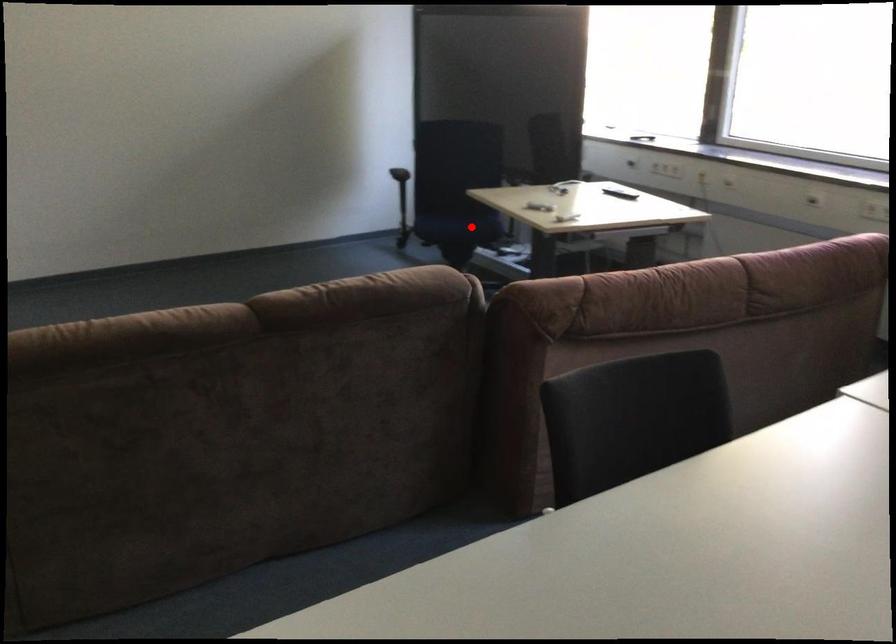
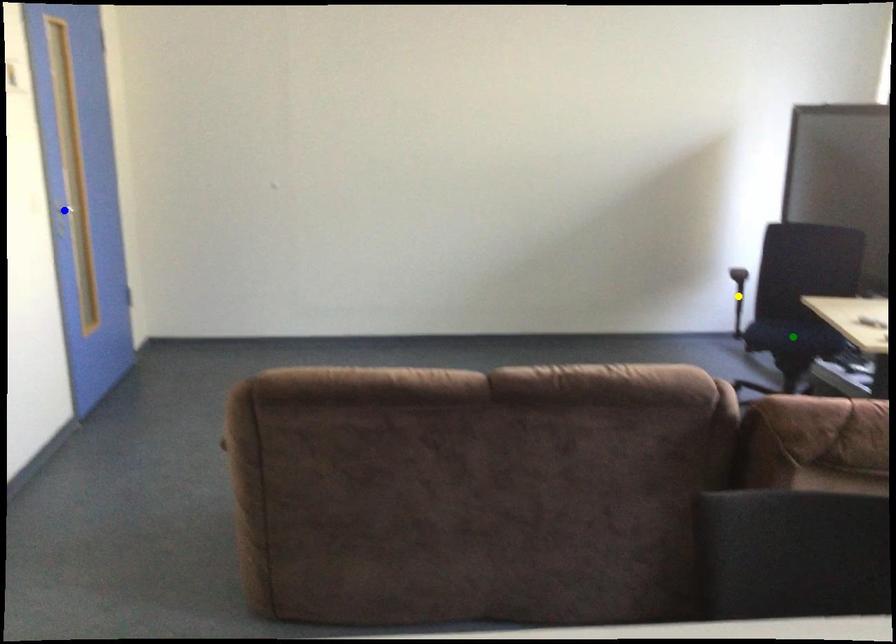
Question: I am providing you with two images of the same scene from different viewpoints. A red point is marked on the first image. You are given multiple points on the second image. Which mark in image 2 goes with the point in image 1?

Choices:
 (A) yellow point
 (B) green point
 (C) blue point

Answer: (B)